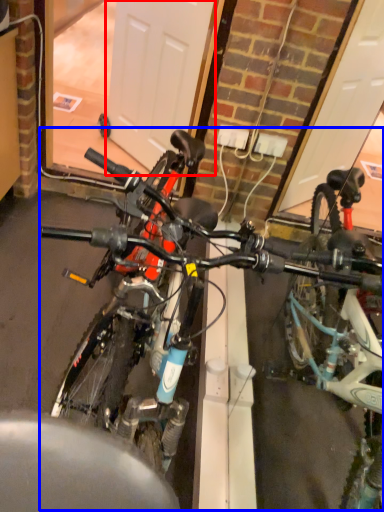
Question: Which object appears closest to the camera in this image, garage door (highlighted by a red box) or bicycle (highlighted by a blue box)?

Choices:
 (A) garage door
 (B) bicycle

Answer: (B)